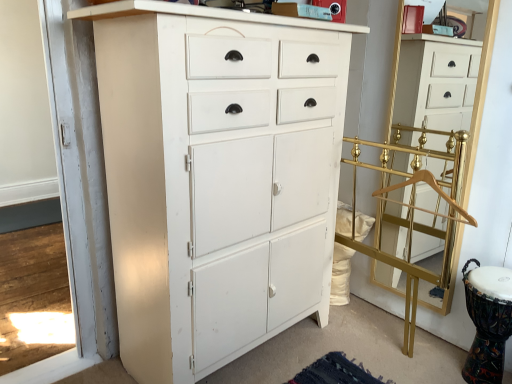
Question: Can you confirm if gold metallic coat rack at right is taller than gold metallic coat rack at right, which is counted as the 2th chest of drawers, starting from the left?

Choices:
 (A) yes
 (B) no

Answer: (B)

Question: Is gold metallic coat rack at right located outside gold metallic coat rack at right, placed as the 1th chest of drawers when sorted from right to left?

Choices:
 (A) yes
 (B) no

Answer: (A)

Question: Can you confirm if gold metallic coat rack at right is bigger than gold metallic coat rack at right, placed as the 1th chest of drawers when sorted from right to left?

Choices:
 (A) yes
 (B) no

Answer: (A)

Question: Is gold metallic coat rack at right to the left of gold metallic coat rack at right, placed as the 1th chest of drawers when sorted from right to left, from the viewer's perspective?

Choices:
 (A) yes
 (B) no

Answer: (A)

Question: From a real-world perspective, is gold metallic coat rack at right over gold metallic coat rack at right, which is counted as the 2th chest of drawers, starting from the left?

Choices:
 (A) yes
 (B) no

Answer: (B)

Question: Looking at their shapes, would you say white painted wood cabinet at center, acting as the first chest of drawers starting from the left, is wider or thinner than gold wooden hanger at right?

Choices:
 (A) thin
 (B) wide

Answer: (B)

Question: From a real-world perspective, is white painted wood cabinet at center, acting as the first chest of drawers starting from the left, above or below gold wooden hanger at right?

Choices:
 (A) above
 (B) below

Answer: (B)

Question: Is white painted wood cabinet at center, acting as the first chest of drawers starting from the left, inside or outside of gold wooden hanger at right?

Choices:
 (A) outside
 (B) inside

Answer: (A)

Question: Is white painted wood cabinet at center, marked as the second chest of drawers in a right-to-left arrangement, taller or shorter than gold wooden hanger at right?

Choices:
 (A) tall
 (B) short

Answer: (A)

Question: Considering the positions of white painted wood cabinet at center, marked as the second chest of drawers in a right-to-left arrangement, and gold metallic coat rack at right in the image, is white painted wood cabinet at center, marked as the second chest of drawers in a right-to-left arrangement, bigger or smaller than gold metallic coat rack at right?

Choices:
 (A) big
 (B) small

Answer: (A)

Question: Is point coord(238,97) positioned closer to the camera than point coord(382,183)?

Choices:
 (A) closer
 (B) farther

Answer: (A)

Question: From their relative heights in the image, would you say white painted wood cabinet at center, acting as the first chest of drawers starting from the left, is taller or shorter than gold metallic coat rack at right?

Choices:
 (A) short
 (B) tall

Answer: (B)

Question: Is white painted wood cabinet at center, marked as the second chest of drawers in a right-to-left arrangement, wider or thinner than gold metallic coat rack at right?

Choices:
 (A) wide
 (B) thin

Answer: (A)

Question: Considering the positions of point (402, 142) and point (440, 130), is point (402, 142) closer or farther from the camera than point (440, 130)?

Choices:
 (A) farther
 (B) closer

Answer: (B)

Question: In terms of width, does gold metallic coat rack at right, placed as the 1th chest of drawers when sorted from right to left, look wider or thinner when compared to gold wooden hanger at right?

Choices:
 (A) wide
 (B) thin

Answer: (A)